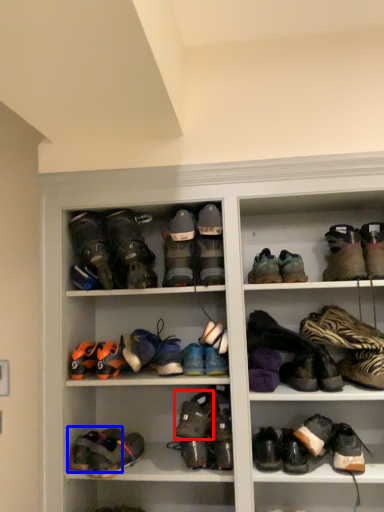
Question: Which of the following is the farthest to the observer, footwear (highlighted by a red box) or footwear (highlighted by a blue box)?

Choices:
 (A) footwear
 (B) footwear

Answer: (B)